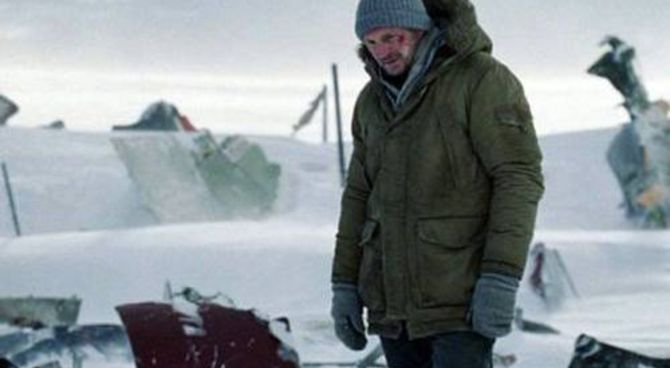
Locate an element on the screen. This screenshot has height=368, width=670. coat is located at coordinates (437, 154).